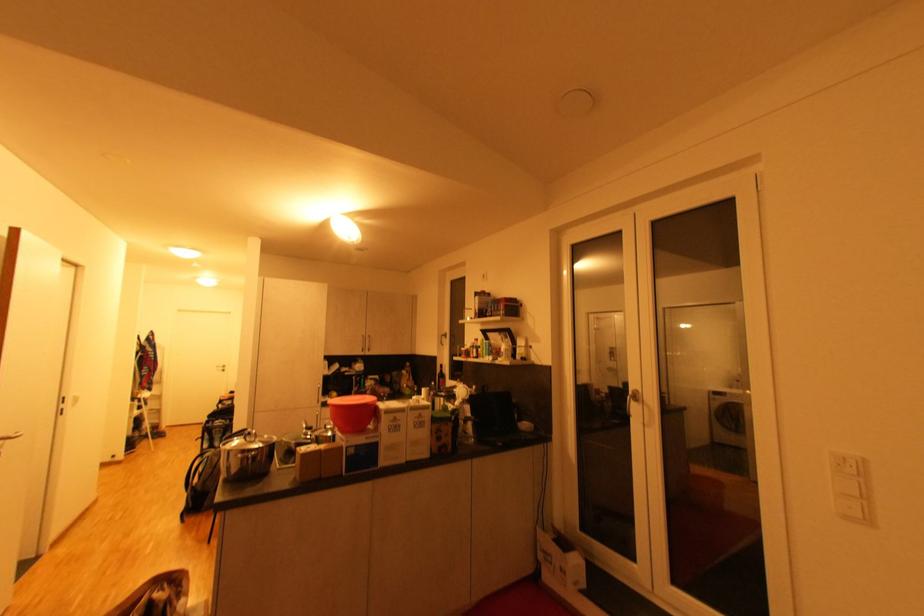
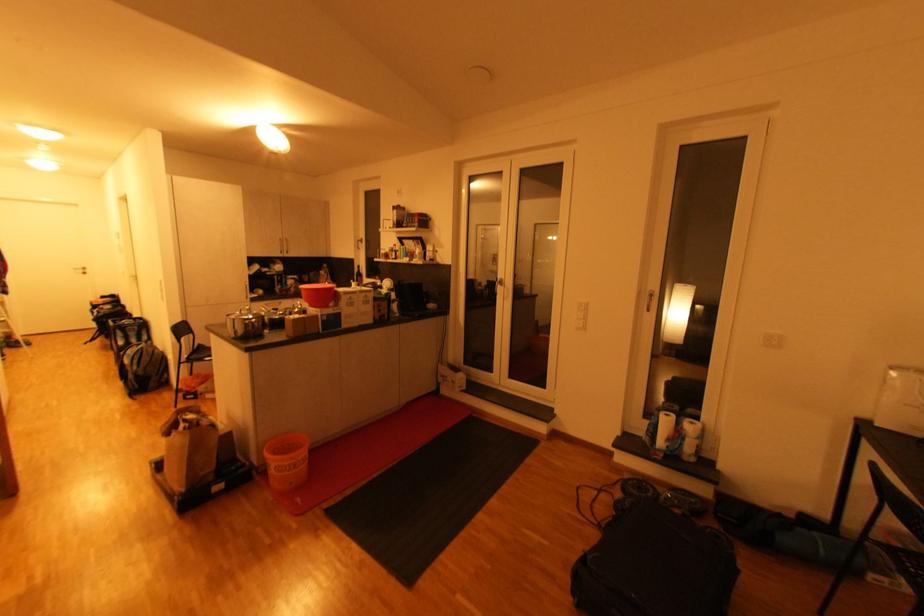
Where in the second image is the point corresponding to point (611, 391) from the first image?

(490, 284)